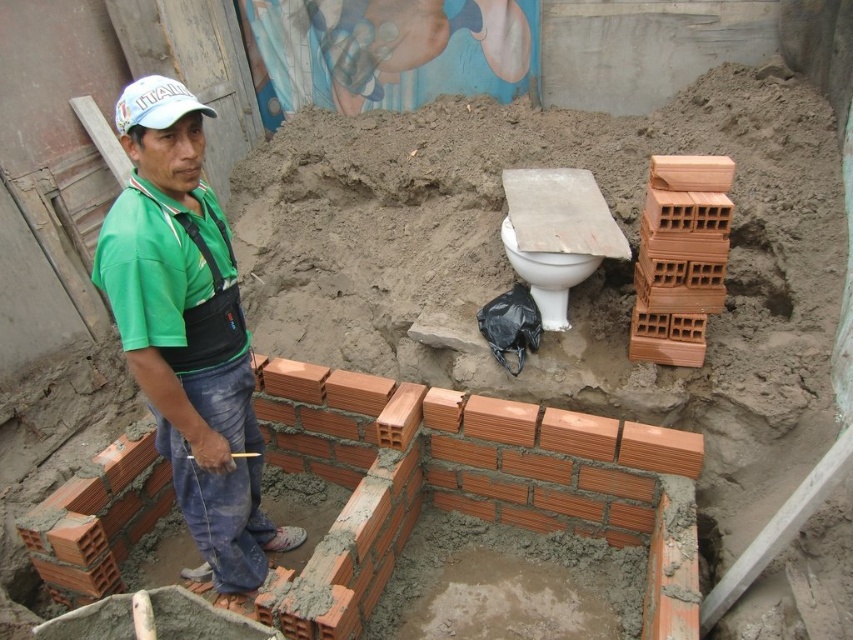
Question: Considering the real-world distances, which object is farthest from the white glossy toilet at center?

Choices:
 (A) green fabric shirt at center
 (B) white matte baseball cap at upper left

Answer: (B)

Question: Does green fabric shirt at center appear on the right side of white glossy toilet at center?

Choices:
 (A) yes
 (B) no

Answer: (B)

Question: Can you confirm if green fabric shirt at center is positioned below white matte baseball cap at upper left?

Choices:
 (A) no
 (B) yes

Answer: (B)

Question: Which point is closer to the camera taking this photo?

Choices:
 (A) (276, 538)
 (B) (560, 285)

Answer: (B)

Question: Can you confirm if green fabric shirt at center is positioned above white matte baseball cap at upper left?

Choices:
 (A) yes
 (B) no

Answer: (B)

Question: Which of the following is the farthest from the observer?

Choices:
 (A) white matte baseball cap at upper left
 (B) green fabric shirt at center
 (C) white glossy toilet at center

Answer: (C)